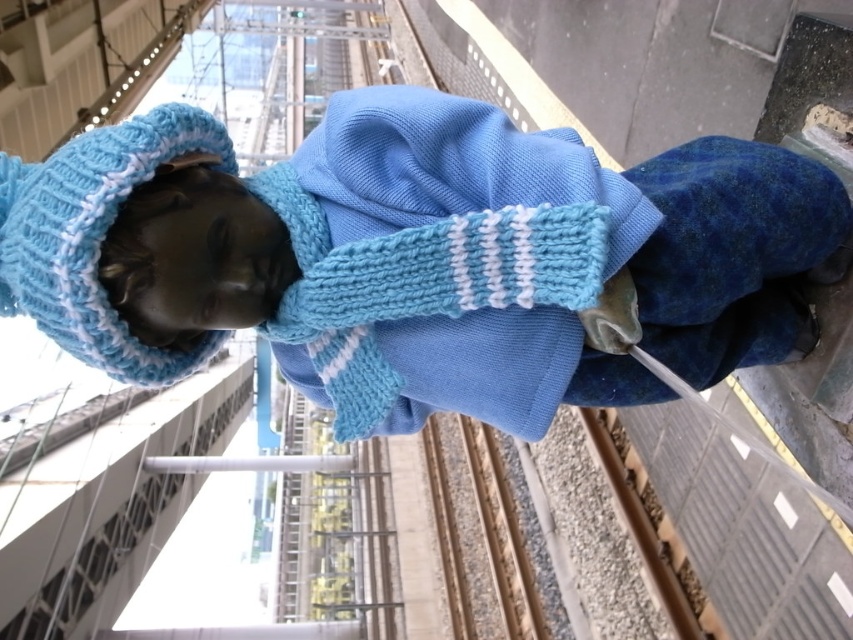
At what (x,y) coordinates should I click in order to perform the action: click on knitted blue sweater at center. Please return your answer as a coordinate pair (x, y). Looking at the image, I should click on (416, 257).

You are a GUI agent. You are given a task and a screenshot of the screen. Output one action in this format:
    pyautogui.click(x=<x>, y=<y>)
    Task: Click on the knitted blue sweater at center
    
    Given the screenshot: What is the action you would take?
    pyautogui.click(x=416, y=257)